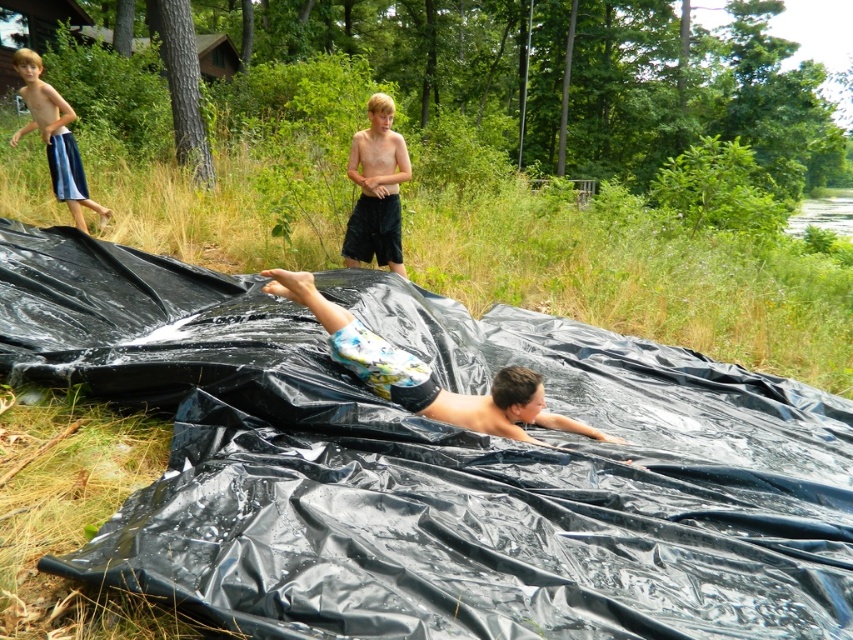
You are standing at the point labeled as point (254, 593) in the image. If you want to throw a ball to a friend who is standing 2 meters away from you, can you reach them by throwing the ball straight ahead?

The distance between you and the viewer is 1.98 meters, which is just under 2 meters. Therefore, you can reach your friend by throwing the ball straight ahead as the distance is slightly less than 2 meters.

You are a photographer trying to capture the children in the scene. You notice two children wearing floral shorts at center and blue striped shorts at upper left. Which child should you focus on if you want to photograph someone closer to the camera?

The floral shorts at center is shorter than blue striped shorts at upper left, so the child wearing floral shorts at center is closer to the camera.

You are a parent supervising the children playing near the black plastic tarp at center and the blue striped shorts at upper left. Which object is located lower in the image?

The black plastic tarp at center is positioned under the blue striped shorts at upper left, so the black plastic tarp at center is lower in the image.